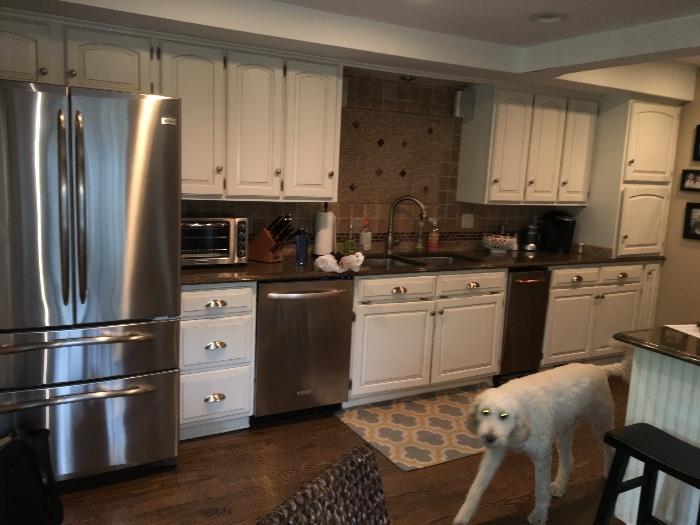
At what (x,y) coordinates should I click in order to perform the action: click on picture frame. Please return your answer as a coordinate pair (x, y). The image size is (700, 525). Looking at the image, I should click on (689, 216), (685, 177), (696, 157).